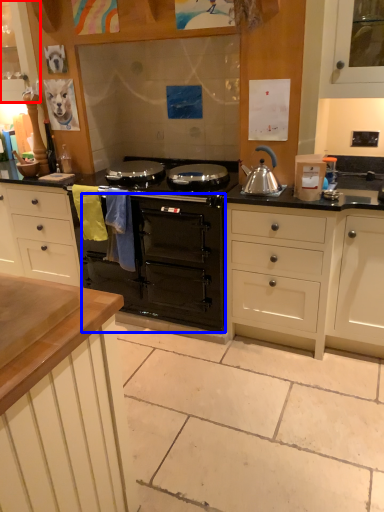
Question: Which point is further to the camera, cabinetry (highlighted by a red box) or oven (highlighted by a blue box)?

Choices:
 (A) cabinetry
 (B) oven

Answer: (A)